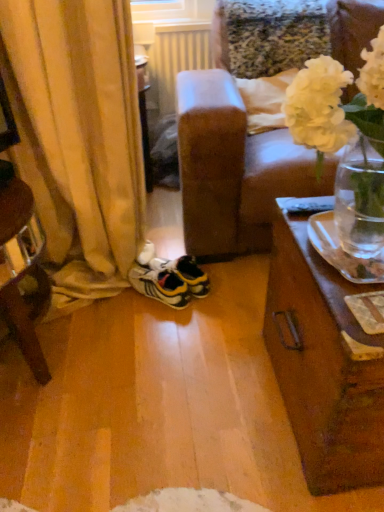
Question: Which is correct: yellow and white synthetic sneakers at center is inside yellow fabric curtain at left, or outside of it?

Choices:
 (A) outside
 (B) inside

Answer: (B)

Question: In terms of height, does yellow and white synthetic sneakers at center look taller or shorter compared to yellow fabric curtain at left?

Choices:
 (A) short
 (B) tall

Answer: (A)

Question: Which object is positioned farthest from the yellow and white synthetic sneakers at center?

Choices:
 (A) yellow fabric curtain at left
 (B) white matte vase at upper right
 (C) white plastic radiator at upper center

Answer: (C)

Question: Which object is positioned farthest from the white matte vase at upper right?

Choices:
 (A) white plastic radiator at upper center
 (B) yellow and white synthetic sneakers at center
 (C) yellow fabric curtain at left

Answer: (A)